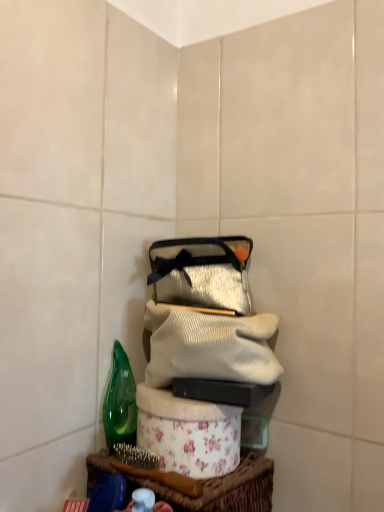
Question: In the image, is floral fabric basket at lower center positioned in front of or behind green glass bottle at left?

Choices:
 (A) front
 (B) behind

Answer: (A)

Question: In terms of width, does floral fabric basket at lower center look wider or thinner when compared to green glass bottle at left?

Choices:
 (A) wide
 (B) thin

Answer: (A)

Question: Which object is the closest to the shiny silver pouch at center?

Choices:
 (A) white ribbed sweater at center
 (B) green glass bottle at left
 (C) floral fabric basket at lower center

Answer: (A)

Question: Which object is the farthest from the shiny silver pouch at center?

Choices:
 (A) white ribbed sweater at center
 (B) floral fabric basket at lower center
 (C) green glass bottle at left

Answer: (B)